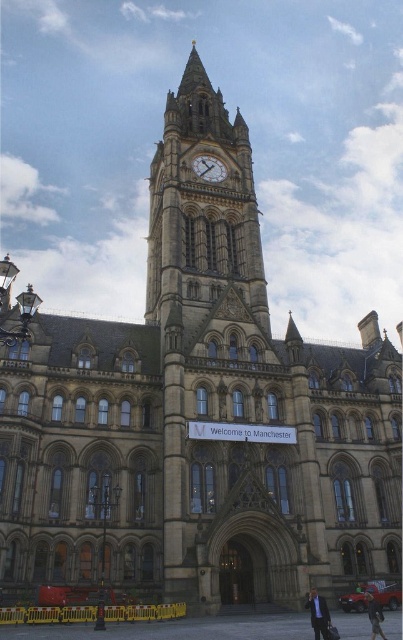
Question: Can you confirm if golden stone clock tower at center is positioned to the right of gold textured clock at center?

Choices:
 (A) no
 (B) yes

Answer: (A)

Question: Which point appears farthest from the camera in this image?

Choices:
 (A) (213, 112)
 (B) (211, 163)

Answer: (A)

Question: Is the position of golden stone clock tower at center less distant than that of gold textured clock at center?

Choices:
 (A) yes
 (B) no

Answer: (A)

Question: Does golden stone clock tower at center appear over gold textured clock at center?

Choices:
 (A) no
 (B) yes

Answer: (B)

Question: Which object is closer to the camera taking this photo?

Choices:
 (A) gold textured clock at center
 (B) golden stone clock tower at center

Answer: (B)

Question: Among these objects, which one is nearest to the camera?

Choices:
 (A) gold textured clock at center
 (B) golden stone clock tower at center

Answer: (B)